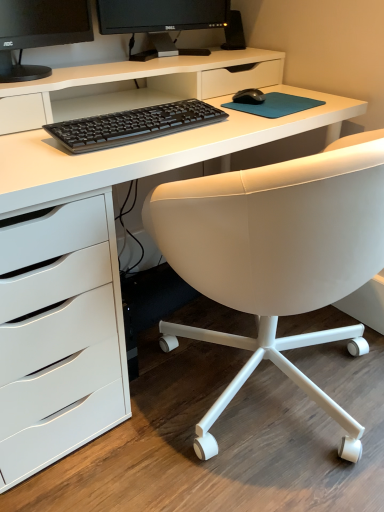
Locate an element on the screen. black matte mouse at center is located at coordinates (249, 96).

In order to face black glossy monitor at upper center, should I rotate leftwards or rightwards?

Rotate your view left by about 2.942°.

Where is `black matte keyboard at center`? This screenshot has height=512, width=384. black matte keyboard at center is located at coordinates (133, 125).

The height and width of the screenshot is (512, 384). What do you see at coordinates (133, 125) in the screenshot?
I see `black matte keyboard at center` at bounding box center [133, 125].

I want to click on black matte mouse at center, so click(x=249, y=96).

Which object is positioned more to the left, black plastic speaker at upper center or white leather chair at center?

black plastic speaker at upper center is more to the left.

Which is correct: black plastic speaker at upper center is inside white leather chair at center, or outside of it?

black plastic speaker at upper center is located beyond the bounds of white leather chair at center.

Which object is wider, black plastic speaker at upper center or white leather chair at center?

Wider between the two is white leather chair at center.

From the image's perspective, is black matte keyboard at center below black matte mouse at center?

Indeed, from the image's perspective, black matte keyboard at center is shown beneath black matte mouse at center.

Which of these two, black matte keyboard at center or black matte mouse at center, is thinner?

Thinner between the two is black matte mouse at center.

Based on the photo, is black matte keyboard at center placed right next to black matte mouse at center?

No.

Is black matte keyboard at center taller or shorter than black matte mouse at center?

black matte keyboard at center is taller than black matte mouse at center.

Does point (250, 97) lie in front of point (242, 42)?

Yes.

Between black matte mouse at center and black plastic speaker at upper center, which one has larger size?

Bigger between the two is black plastic speaker at upper center.

From a real-world perspective, is black matte mouse at center positioned under black plastic speaker at upper center based on gravity?

Yes.

Is black matte mouse at center facing away from black plastic speaker at upper center?

No, black matte mouse at center's orientation is not away from black plastic speaker at upper center.

Where is `chair below the black matte mouse at center (from a real-world perspective)`? The image size is (384, 512). chair below the black matte mouse at center (from a real-world perspective) is located at coordinates (277, 256).

Considering the sizes of objects white leather chair at center and black matte mouse at center in the image provided, who is bigger, white leather chair at center or black matte mouse at center?

With larger size is white leather chair at center.

Which object is more forward, white leather chair at center or black matte mouse at center?

white leather chair at center is more forward.

Can you confirm if white leather chair at center is wider than black matte mouse at center?

Correct, the width of white leather chair at center exceeds that of black matte mouse at center.

From the image's perspective, which one is positioned lower, black matte mouse at center or white leather chair at center?

From the image's view, white leather chair at center is below.

Is there a large distance between black matte mouse at center and white leather chair at center?

black matte mouse at center is near white leather chair at center, not far away.

Is black matte mouse at center inside or outside of white leather chair at center?

black matte mouse at center exists entirely within white leather chair at center.

From a real-world perspective, which object stands above the other?

In real-world perspective, black matte mouse at center is above.

From a real-world perspective, is black matte keyboard at center located beneath black glossy monitor at upper center?

Indeed, from a real-world perspective, black matte keyboard at center is positioned beneath black glossy monitor at upper center.

Is black matte keyboard at center behind black glossy monitor at upper center?

No, it is not.

Is black matte keyboard at center surrounding black glossy monitor at upper center?

No, black glossy monitor at upper center is not inside black matte keyboard at center.

Which of these two, white leather chair at center or black plastic speaker at upper center, is wider?

white leather chair at center is wider.

Based on the photo, from a real-world perspective, who is located lower, white leather chair at center or black plastic speaker at upper center?

white leather chair at center, from a real-world perspective.

Is point (179, 240) closer or farther from the camera than point (244, 41)?

Point (179, 240).

The width and height of the screenshot is (384, 512). Identify the location of chair that is below the black plastic speaker at upper center (from the image's perspective). (277, 256).

You are a GUI agent. You are given a task and a screenshot of the screen. Output one action in this format:
    pyautogui.click(x=<x>, y=<y>)
    Task: Click on the computer keyboard that is under the black matte mouse at center (from a real-world perspective)
    
    Given the screenshot: What is the action you would take?
    pyautogui.click(x=133, y=125)

When comparing their distances from black matte mouse at center, does black plastic speaker at upper center or black matte keyboard at center seem closer?

Based on the image, black matte keyboard at center appears to be nearer to black matte mouse at center.

From the image, which object appears to be nearer to black plastic speaker at upper center, white leather chair at center or black matte mouse at center?

→ black matte mouse at center.

Estimate the real-world distances between objects in this image. Which object is closer to white leather chair at center, black plastic speaker at upper center or black matte mouse at center?

black matte mouse at center lies closer to white leather chair at center than the other object.

Consider the image. Looking at the image, which one is located closer to white leather chair at center, black matte mouse at center or black glossy monitor at upper center?

black matte mouse at center.

Looking at the image, which one is located further to white leather chair at center, black glossy monitor at upper center or black matte keyboard at center?

black glossy monitor at upper center lies further to white leather chair at center than the other object.

Which object lies nearer to the anchor point black matte keyboard at center, white leather chair at center or black glossy monitor at upper center?

white leather chair at center is closer to black matte keyboard at center.

Estimate the real-world distances between objects in this image. Which object is closer to black matte keyboard at center, black glossy monitor at upper center or white leather chair at center?

Based on the image, white leather chair at center appears to be nearer to black matte keyboard at center.

From the image, which object appears to be nearer to black matte mouse at center, black plastic speaker at upper center or white leather chair at center?

black plastic speaker at upper center is closer to black matte mouse at center.

Identify the location of computer monitor that lies between black plastic speaker at upper center and black matte mouse at center from top to bottom. This screenshot has width=384, height=512. (161, 21).

Where is `mouse positioned between white leather chair at center and black plastic speaker at upper center from near to far`? The height and width of the screenshot is (512, 384). mouse positioned between white leather chair at center and black plastic speaker at upper center from near to far is located at coordinates (249, 96).

The width and height of the screenshot is (384, 512). In order to click on computer keyboard that lies between black glossy monitor at upper center and white leather chair at center from top to bottom in this screenshot , I will do `click(133, 125)`.

The image size is (384, 512). What are the coordinates of `mouse between black matte keyboard at center and black plastic speaker at upper center along the z-axis` in the screenshot? It's located at (249, 96).